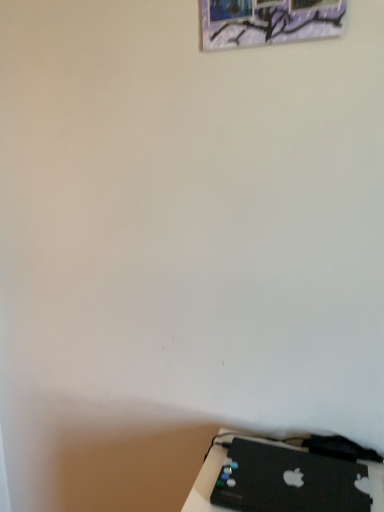
Question: From their relative heights in the image, would you say black matte laptop at lower right is taller or shorter than metallic silver picture frame at upper center?

Choices:
 (A) short
 (B) tall

Answer: (A)

Question: From the image's perspective, is black matte laptop at lower right located above or below metallic silver picture frame at upper center?

Choices:
 (A) below
 (B) above

Answer: (A)

Question: Is black matte laptop at lower right to the left or to the right of metallic silver picture frame at upper center in the image?

Choices:
 (A) left
 (B) right

Answer: (B)

Question: In the image, is metallic silver picture frame at upper center positioned in front of or behind black matte laptop at lower right?

Choices:
 (A) front
 (B) behind

Answer: (B)

Question: Considering the positions of point (332, 33) and point (291, 508), is point (332, 33) closer or farther from the camera than point (291, 508)?

Choices:
 (A) farther
 (B) closer

Answer: (A)

Question: Is metallic silver picture frame at upper center spatially inside black matte laptop at lower right, or outside of it?

Choices:
 (A) inside
 (B) outside

Answer: (B)

Question: From the image's perspective, is metallic silver picture frame at upper center located above or below black matte laptop at lower right?

Choices:
 (A) below
 (B) above

Answer: (B)